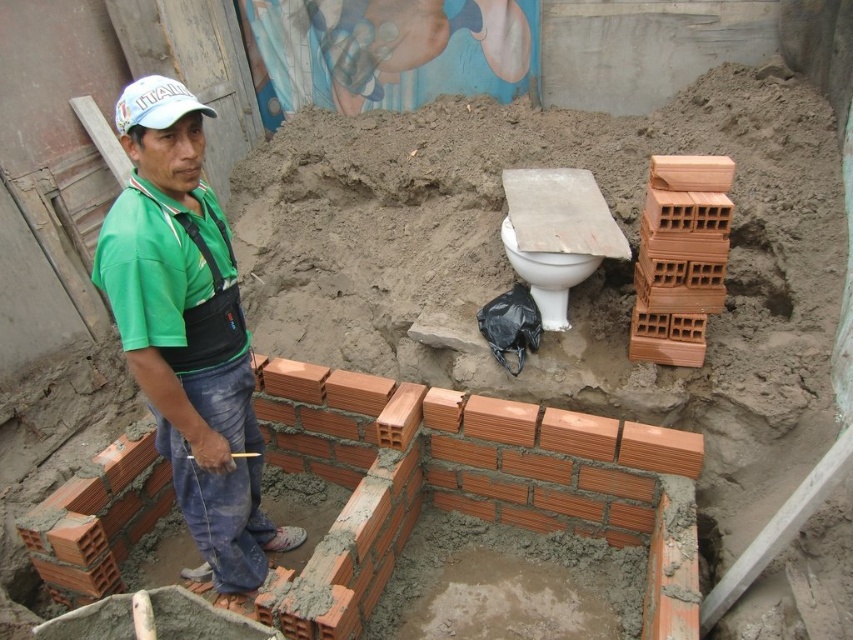
In the scene shown: Does green fabric shirt at center have a lesser width compared to white glossy toilet at center?

No, green fabric shirt at center is not thinner than white glossy toilet at center.

Is green fabric shirt at center behind white glossy toilet at center?

No, green fabric shirt at center is closer to the viewer.

Who is more forward, (202, 324) or (558, 282)?

Positioned in front is point (202, 324).

At what (x,y) coordinates should I click in order to perform the action: click on green fabric shirt at center. Please return your answer as a coordinate pair (x, y). The image size is (853, 640). Looking at the image, I should click on (189, 332).

Can you confirm if green fabric shirt at center is positioned to the left of white matte baseball cap at upper left?

Indeed, green fabric shirt at center is positioned on the left side of white matte baseball cap at upper left.

Identify the location of green fabric shirt at center. The height and width of the screenshot is (640, 853). (189, 332).

Measure the distance between point (126, 125) and camera.

They are 1.83 meters apart.

Identify the location of green fabric shirt at center. (189, 332).

Is white glossy toilet at center wider than white matte baseball cap at upper left?

Indeed, white glossy toilet at center has a greater width compared to white matte baseball cap at upper left.

Between point (566, 317) and point (164, 77), which one is positioned behind?

Positioned behind is point (566, 317).

Image resolution: width=853 pixels, height=640 pixels. What are the coordinates of `white glossy toilet at center` in the screenshot? It's located at (547, 276).

Locate an element on the screen. Image resolution: width=853 pixels, height=640 pixels. white glossy toilet at center is located at coordinates (547, 276).